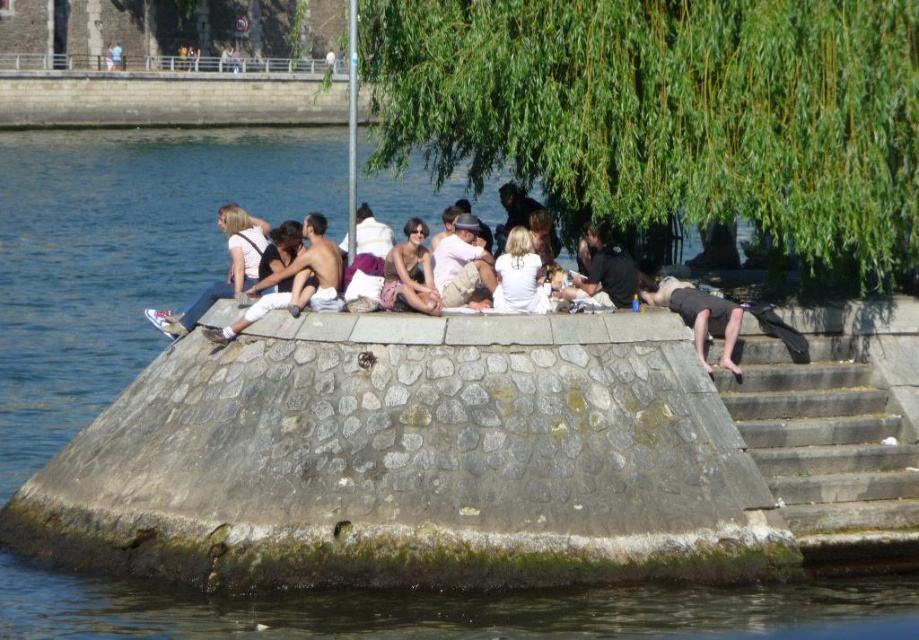
You are standing on the stone structure and want to go down to the lower area. You see the stone stairs at lower right and the matte black shirt at center. Which object is located to the right of the other?

The stone stairs at lower right is positioned on the right side of matte black shirt at center, so the stone stairs at lower right is to the right of the matte black shirt at center.

You are standing at the riverside and see the dark gray stone person at lower right. If you want to throw a pebble to reach it, what is the minimum distance you need to throw?

The dark gray stone person at lower right is 41.90 meters away from the viewer, so you need to throw the pebble at least 41.90 meters to reach it.